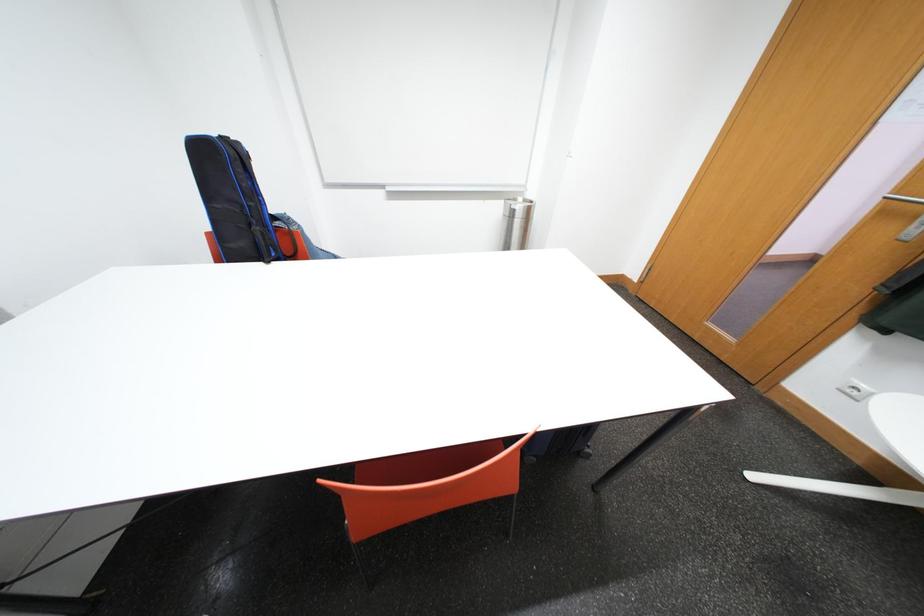
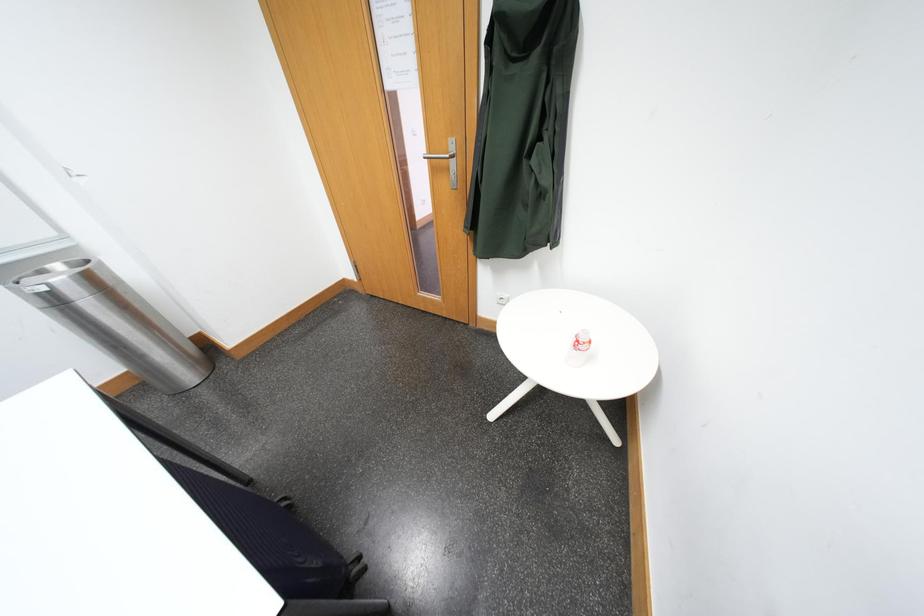
Question: Based on the continuous images, in which direction is the camera rotating? Reply with the corresponding letter.

Choices:
 (A) Left
 (B) Right
 (C) Up
 (D) Down

Answer: (B)